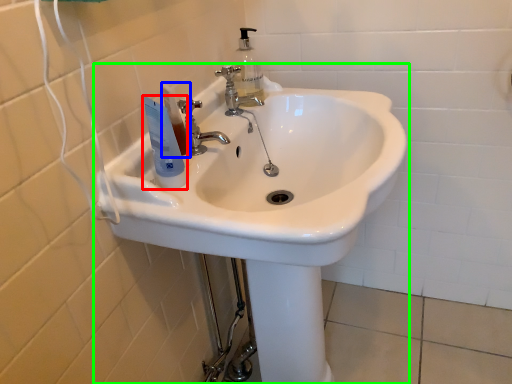
Question: Which object is positioned farthest from mouthwash (highlighted by a red box)? Select from toiletry (highlighted by a blue box) and sink (highlighted by a green box).

Choices:
 (A) toiletry
 (B) sink

Answer: (B)